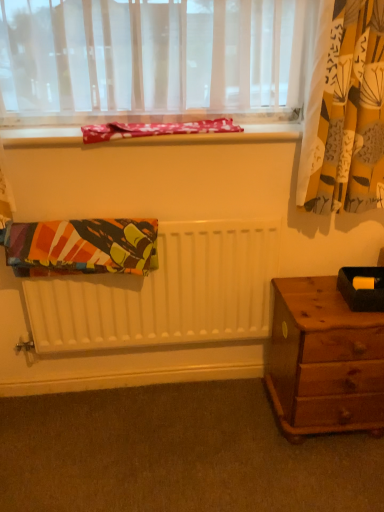
This screenshot has height=512, width=384. I want to click on free spot to the left of black matte box at right, so click(312, 292).